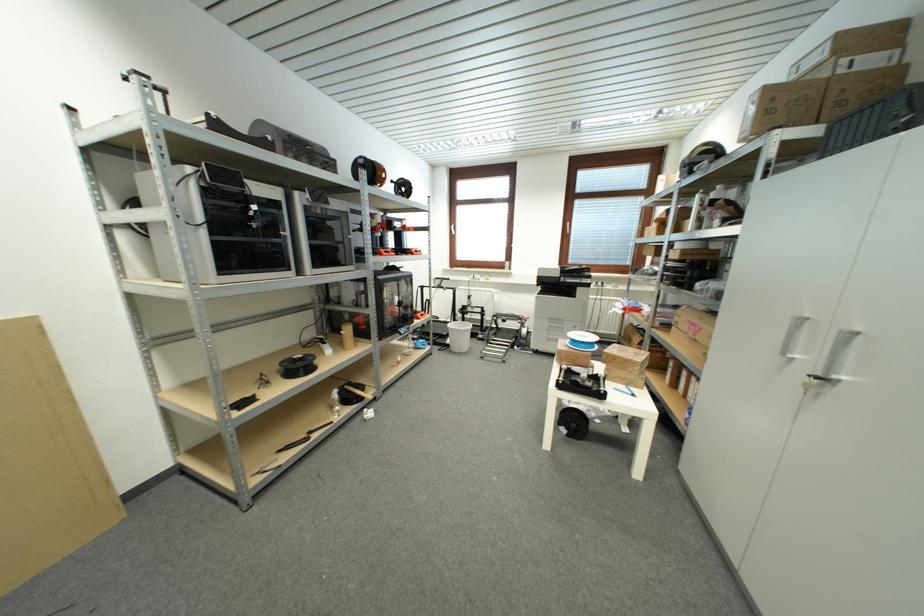
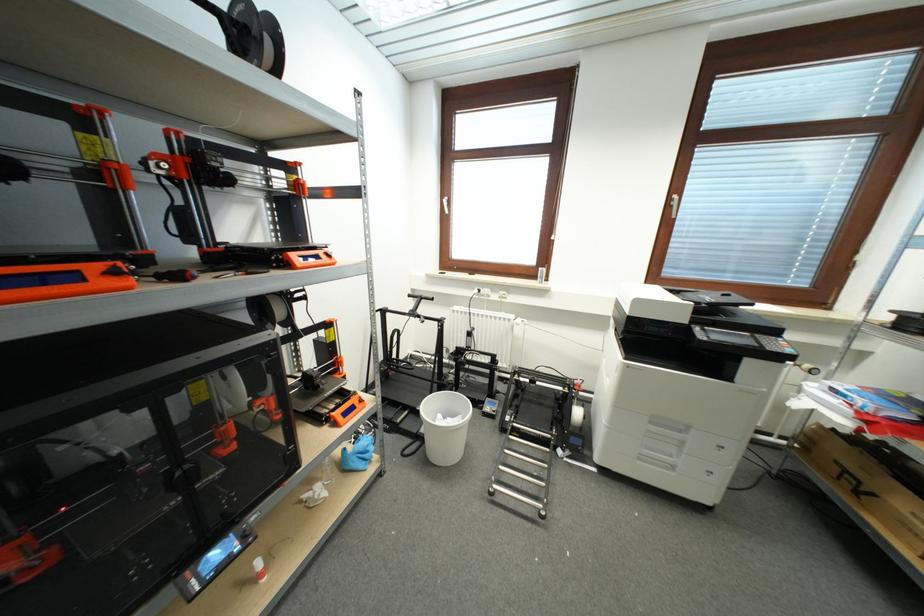
Where in the second image is the point corresponding to (456,228) from the first image?

(446, 200)